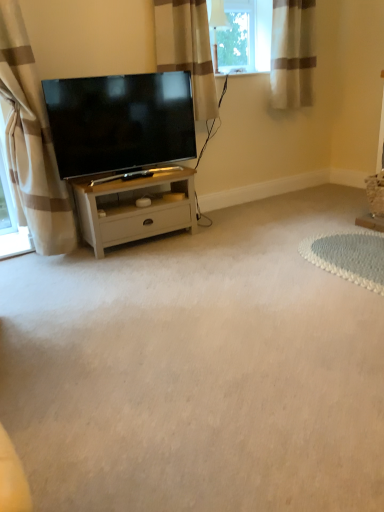
What do you see at coordinates (120, 122) in the screenshot? I see `matte black tv at center` at bounding box center [120, 122].

The height and width of the screenshot is (512, 384). What are the coordinates of `beige fabric curtain at upper center, the second curtain when ordered from right to left` in the screenshot? It's located at tap(187, 49).

Is beige striped curtain at upper right, which is counted as the 3th curtain, starting from the left, inside or outside of beige striped curtain at left, the third curtain when ordered from right to left?

beige striped curtain at upper right, which is counted as the 3th curtain, starting from the left, is not enclosed by beige striped curtain at left, the third curtain when ordered from right to left.

In terms of height, does beige striped curtain at upper right, which is the 1th curtain in right-to-left order, look taller or shorter compared to beige striped curtain at left, the third curtain when ordered from right to left?

beige striped curtain at upper right, which is the 1th curtain in right-to-left order, is shorter than beige striped curtain at left, the third curtain when ordered from right to left.

From the image's perspective, relative to beige striped curtain at left, the third curtain when ordered from right to left, is beige striped curtain at upper right, which is the 1th curtain in right-to-left order, above or below?

beige striped curtain at upper right, which is the 1th curtain in right-to-left order, is above beige striped curtain at left, the third curtain when ordered from right to left.

Starting from the beige striped curtain at upper right, which is counted as the 3th curtain, starting from the left, which curtain is the 2nd one to the left? Please provide its 2D coordinates.

[(31, 142)]

Does matte black tv at center have a lesser height compared to white wood cabinet at center?

No, matte black tv at center is not shorter than white wood cabinet at center.

From the image's perspective, which one is positioned lower, matte black tv at center or white wood cabinet at center?

white wood cabinet at center.

Choose the correct answer: Is matte black tv at center inside white wood cabinet at center or outside it?

matte black tv at center is not inside white wood cabinet at center, it's outside.

Is matte black tv at center turned away from white wood cabinet at center?

matte black tv at center does not have its back to white wood cabinet at center.

Is matte black tv at center at the right side of beige striped curtain at upper right, which is the 1th curtain in right-to-left order?

No.

Consider the image. Between matte black tv at center and beige striped curtain at upper right, which is the 1th curtain in right-to-left order, which one has smaller width?

matte black tv at center is thinner.

Is matte black tv at center further to the viewer compared to beige striped curtain at upper right, which is the 1th curtain in right-to-left order?

No.

From the picture: What's the angular difference between beige striped curtain at left, the 1th curtain in the left-to-right sequence, and beige fabric curtain at upper center, the second curtain when ordered from right to left,'s facing directions?

The facing directions of beige striped curtain at left, the 1th curtain in the left-to-right sequence, and beige fabric curtain at upper center, the second curtain when ordered from right to left, are 0.223 degrees apart.

Is beige striped curtain at left, the 1th curtain in the left-to-right sequence, not near beige fabric curtain at upper center, the second curtain when ordered from left to right?

That's right, there is a large distance between beige striped curtain at left, the 1th curtain in the left-to-right sequence, and beige fabric curtain at upper center, the second curtain when ordered from left to right.

From the image's perspective, does beige striped curtain at left, the 1th curtain in the left-to-right sequence, appear lower than beige fabric curtain at upper center, the second curtain when ordered from right to left?

Correct, beige striped curtain at left, the 1th curtain in the left-to-right sequence, appears lower than beige fabric curtain at upper center, the second curtain when ordered from right to left, in the image.

Is beige striped curtain at left, the third curtain when ordered from right to left, taller or shorter than beige fabric curtain at upper center, the second curtain when ordered from right to left?

Considering their sizes, beige striped curtain at left, the third curtain when ordered from right to left, has more height than beige fabric curtain at upper center, the second curtain when ordered from right to left.

From the image's perspective, would you say beige striped curtain at upper right, which is the 1th curtain in right-to-left order, is shown under matte black tv at center?

No.

Between beige striped curtain at upper right, which is counted as the 3th curtain, starting from the left, and matte black tv at center, which one has larger size?

matte black tv at center is bigger.

Could you tell me if beige striped curtain at upper right, which is the 1th curtain in right-to-left order, is turned towards matte black tv at center?

No.

Is beige striped curtain at upper right, which is the 1th curtain in right-to-left order, wider than matte black tv at center?

Indeed, beige striped curtain at upper right, which is the 1th curtain in right-to-left order, has a greater width compared to matte black tv at center.

From the picture: Is beige striped curtain at left, the 1th curtain in the left-to-right sequence, in contact with white wood cabinet at center?

beige striped curtain at left, the 1th curtain in the left-to-right sequence, is not next to white wood cabinet at center, and they're not touching.

Can you confirm if beige striped curtain at left, the 1th curtain in the left-to-right sequence, is smaller than white wood cabinet at center?

Incorrect, beige striped curtain at left, the 1th curtain in the left-to-right sequence, is not smaller in size than white wood cabinet at center.

Considering the sizes of objects beige striped curtain at left, the 1th curtain in the left-to-right sequence, and white wood cabinet at center in the image provided, who is wider, beige striped curtain at left, the 1th curtain in the left-to-right sequence, or white wood cabinet at center?

Wider between the two is white wood cabinet at center.

Is beige striped curtain at left, the third curtain when ordered from right to left, taller than white wood cabinet at center?

Indeed, beige striped curtain at left, the third curtain when ordered from right to left, has a greater height compared to white wood cabinet at center.

Considering the positions of objects beige striped curtain at upper right, which is counted as the 3th curtain, starting from the left, and white wood cabinet at center in the image provided, who is behind, beige striped curtain at upper right, which is counted as the 3th curtain, starting from the left, or white wood cabinet at center?

beige striped curtain at upper right, which is counted as the 3th curtain, starting from the left, is behind.

From a real-world perspective, is beige striped curtain at upper right, which is the 1th curtain in right-to-left order, physically above white wood cabinet at center?

Yes, from a real-world perspective, beige striped curtain at upper right, which is the 1th curtain in right-to-left order, is above white wood cabinet at center.

Based on the photo, is beige striped curtain at upper right, which is counted as the 3th curtain, starting from the left, facing away from white wood cabinet at center?

No, beige striped curtain at upper right, which is counted as the 3th curtain, starting from the left, is not facing the opposite direction of white wood cabinet at center.

Find the location of `curtain that is the 2nd object directly below the beige striped curtain at upper right, which is the 1th curtain in right-to-left order (from a real-world perspective)`. curtain that is the 2nd object directly below the beige striped curtain at upper right, which is the 1th curtain in right-to-left order (from a real-world perspective) is located at coordinates (31, 142).

The width and height of the screenshot is (384, 512). There is a white wood cabinet at center. What are the coordinates of `television above it (from a real-world perspective)` in the screenshot? It's located at (120, 122).

When comparing their distances from matte black tv at center, does beige striped curtain at upper right, which is counted as the 3th curtain, starting from the left, or beige fabric curtain at upper center, the second curtain when ordered from left to right, seem closer?

Among the two, beige fabric curtain at upper center, the second curtain when ordered from left to right, is located nearer to matte black tv at center.

Looking at the image, which one is located closer to matte black tv at center, white wood cabinet at center or beige striped curtain at upper right, which is the 1th curtain in right-to-left order?

Among the two, white wood cabinet at center is located nearer to matte black tv at center.

Based on their spatial positions, is beige striped curtain at left, the third curtain when ordered from right to left, or matte black tv at center further from white wood cabinet at center?

Based on the image, beige striped curtain at left, the third curtain when ordered from right to left, appears to be further to white wood cabinet at center.

Which object lies further to the anchor point beige striped curtain at left, the 1th curtain in the left-to-right sequence, white wood cabinet at center or matte black tv at center?

The object further to beige striped curtain at left, the 1th curtain in the left-to-right sequence, is white wood cabinet at center.

Estimate the real-world distances between objects in this image. Which object is further from beige fabric curtain at upper center, the second curtain when ordered from right to left, beige striped curtain at upper right, which is the 1th curtain in right-to-left order, or beige striped curtain at left, the 1th curtain in the left-to-right sequence?

beige striped curtain at left, the 1th curtain in the left-to-right sequence, is positioned further to the anchor beige fabric curtain at upper center, the second curtain when ordered from right to left.

Considering their positions, is beige fabric curtain at upper center, the second curtain when ordered from right to left, positioned closer to white wood cabinet at center than beige striped curtain at upper right, which is counted as the 3th curtain, starting from the left?

beige fabric curtain at upper center, the second curtain when ordered from right to left, is positioned closer to the anchor white wood cabinet at center.

When comparing their distances from beige striped curtain at upper right, which is the 1th curtain in right-to-left order, does beige fabric curtain at upper center, the second curtain when ordered from left to right, or beige striped curtain at left, the 1th curtain in the left-to-right sequence, seem further?

Among the two, beige striped curtain at left, the 1th curtain in the left-to-right sequence, is located further to beige striped curtain at upper right, which is the 1th curtain in right-to-left order.

Based on the photo, which object lies further to the anchor point beige striped curtain at left, the 1th curtain in the left-to-right sequence, beige striped curtain at upper right, which is the 1th curtain in right-to-left order, or beige fabric curtain at upper center, the second curtain when ordered from left to right?

beige striped curtain at upper right, which is the 1th curtain in right-to-left order, is positioned further to the anchor beige striped curtain at left, the 1th curtain in the left-to-right sequence.

Locate an element on the screen. curtain that lies between beige fabric curtain at upper center, the second curtain when ordered from right to left, and white wood cabinet at center from top to bottom is located at coordinates (31, 142).

Locate an element on the screen. This screenshot has width=384, height=512. television located between beige striped curtain at left, the third curtain when ordered from right to left, and beige fabric curtain at upper center, the second curtain when ordered from left to right, in the left-right direction is located at coordinates (120, 122).

This screenshot has width=384, height=512. I want to click on television between beige striped curtain at left, the 1th curtain in the left-to-right sequence, and white wood cabinet at center from left to right, so click(x=120, y=122).

I want to click on television between beige striped curtain at left, the 1th curtain in the left-to-right sequence, and beige striped curtain at upper right, which is the 1th curtain in right-to-left order, so click(x=120, y=122).